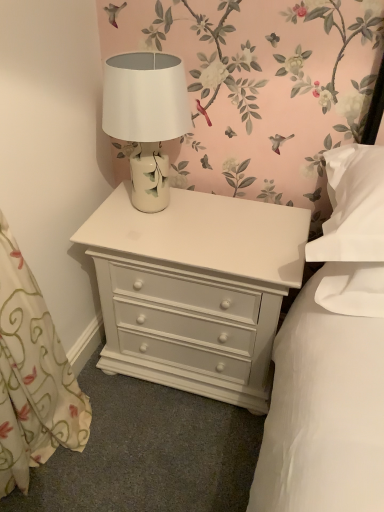
The height and width of the screenshot is (512, 384). I want to click on vacant space underneath white ceramic table lamp at center (from a real-world perspective), so click(162, 210).